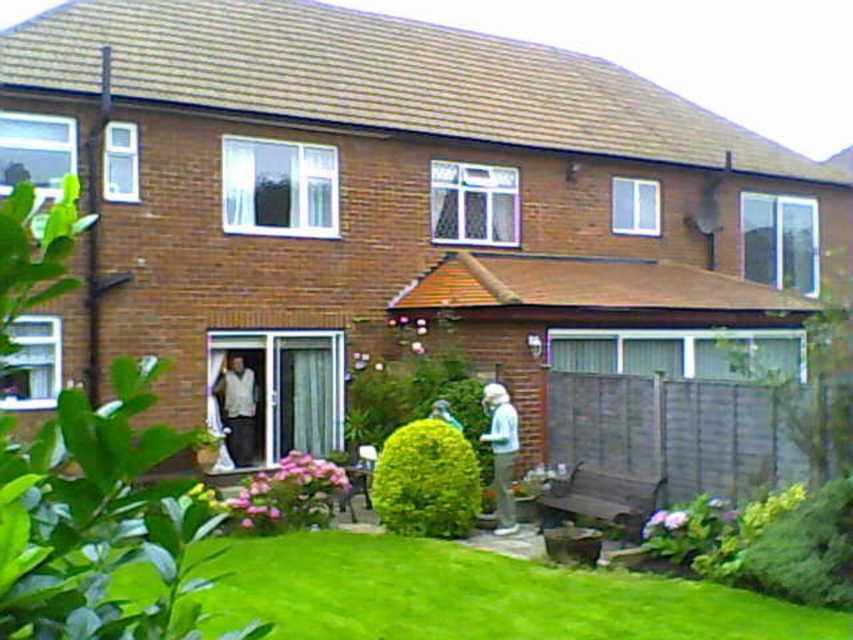
Question: Does light blue fabric at lower center have a greater width compared to light blue fabric jacket at lower center?

Choices:
 (A) yes
 (B) no

Answer: (A)

Question: Which of the following is the closest to the observer?

Choices:
 (A) (231, 426)
 (B) (514, 528)
 (C) (376, 460)
 (D) (399, 580)

Answer: (D)

Question: Which point is closer to the camera?

Choices:
 (A) (244, 365)
 (B) (451, 424)
 (C) (660, 592)
 (D) (474, 509)

Answer: (C)

Question: Is green leafy bush at center above light blue fabric jacket at lower center?

Choices:
 (A) no
 (B) yes

Answer: (A)

Question: Can you confirm if green leafy bush at center is smaller than light blue fabric jacket at lower center?

Choices:
 (A) yes
 (B) no

Answer: (B)

Question: Which point appears farthest from the camera in this image?

Choices:
 (A) (248, 420)
 (B) (712, 605)

Answer: (A)